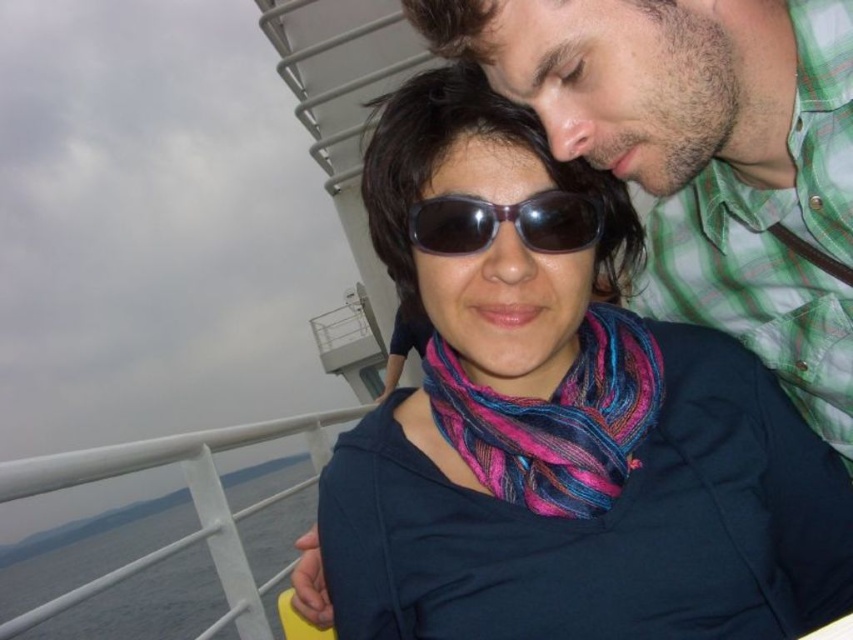
Question: Where is matte black sunglasses at center located in relation to multicolored woven scarf at center in the image?

Choices:
 (A) below
 (B) above

Answer: (A)

Question: Which object is the closest to the matte black sunglasses at center?

Choices:
 (A) multicolored woven scarf at center
 (B) sunglasses at center

Answer: (A)

Question: Is multicolored woven scarf at center thinner than sunglasses at center?

Choices:
 (A) yes
 (B) no

Answer: (B)

Question: Can you confirm if multicolored woven scarf at center is positioned above sunglasses at center?

Choices:
 (A) no
 (B) yes

Answer: (A)

Question: Considering the real-world distances, which object is closest to the matte black sunglasses at center?

Choices:
 (A) sunglasses at center
 (B) multicolored woven scarf at center

Answer: (B)

Question: Which of the following is the closest to the observer?

Choices:
 (A) sunglasses at center
 (B) matte black sunglasses at center
 (C) multicolored woven scarf at center

Answer: (B)